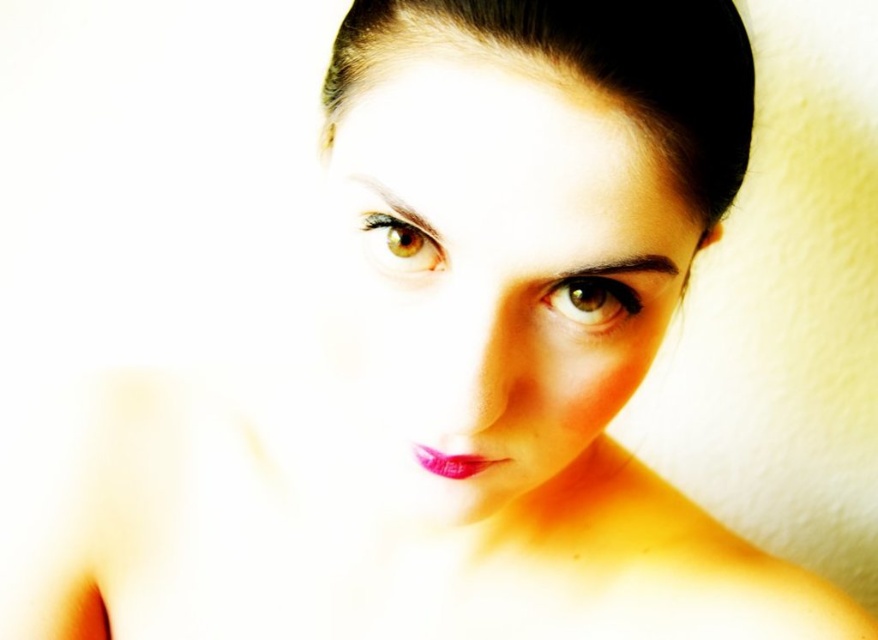
You are a makeup artist analyzing the portrait. You notice the smooth skin face at center and the shiny pink lipstick at center. Which object is positioned to the left?

The shiny pink lipstick at center is positioned to the left of the smooth skin face at center.

Looking at the image, there is a point at coordinates (499, 262). What does this point correspond to?

The point at coordinates (499, 262) corresponds to the smooth skin face at center.

You are a photographer adjusting the lighting for a portrait. The subject has a smooth skin face at center. Based on the scene description, where should you position the main light to best highlight their features?

The smooth skin face at center is located at point (499, 262). To best highlight their features, position the main light slightly above and to the side of this point to create soft shadows and enhance the natural contours of the face.